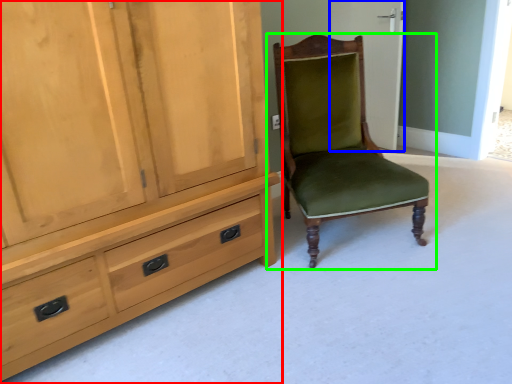
Question: Which object is the closest to the cabinetry (highlighted by a red box)? Choose among these: screen door (highlighted by a blue box) or chair (highlighted by a green box).

Choices:
 (A) screen door
 (B) chair

Answer: (B)